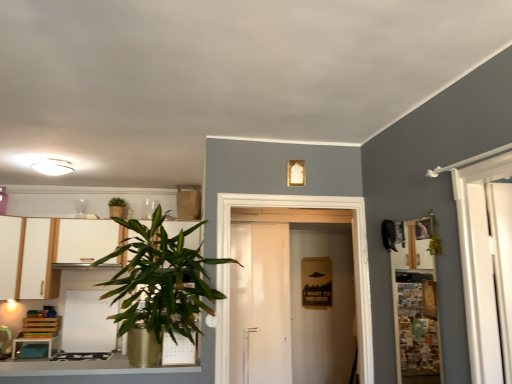
This screenshot has width=512, height=384. I want to click on white glossy cabinet at left, so click(49, 251).

Image resolution: width=512 pixels, height=384 pixels. Describe the element at coordinates (415, 304) in the screenshot. I see `wooden/matte shelf at right` at that location.

Consider the image. Measure the distance between wooden/matte shelf at right and camera.

The depth of wooden/matte shelf at right is 1.90 meters.

The width and height of the screenshot is (512, 384). I want to click on white matte cabinet at left, the second cabinetry in the left-to-right sequence, so click(27, 258).

This screenshot has width=512, height=384. What are the coordinates of `white matte cabinet at left, the 2th cabinetry in the right-to-left sequence` in the screenshot? It's located at (11, 255).

What do you see at coordinates (159, 287) in the screenshot?
I see `green leafy plant at left, which is counted as the second houseplant, starting from the back` at bounding box center [159, 287].

Locate an element on the screen. The height and width of the screenshot is (384, 512). white glossy cabinet at left is located at coordinates (49, 251).

Does white matte cabinet at left, the second cabinetry in the left-to-right sequence, appear on the left side of white glossy cabinet at left?

Indeed, white matte cabinet at left, the second cabinetry in the left-to-right sequence, is positioned on the left side of white glossy cabinet at left.

From a real-world perspective, does white matte cabinet at left, which appears as the first cabinetry when viewed from the right, sit lower than white glossy cabinet at left?

Yes, from a real-world perspective, white matte cabinet at left, which appears as the first cabinetry when viewed from the right, is beneath white glossy cabinet at left.

Would you consider white matte cabinet at left, which appears as the first cabinetry when viewed from the right, to be distant from white glossy cabinet at left?

They are positioned close to each other.

Would you say white glossy cabinet at left is part of white matte cabinet at left, which appears as the first cabinetry when viewed from the right,'s contents?

That's incorrect, white glossy cabinet at left is not inside white matte cabinet at left, which appears as the first cabinetry when viewed from the right.

Is green leafy plant at left, which is the first houseplant in right-to-left order, not inside green leafy plant at upper left, the first houseplant from the back?

green leafy plant at left, which is the first houseplant in right-to-left order, is positioned outside green leafy plant at upper left, the first houseplant from the back.

Is green leafy plant at left, the 1th houseplant viewed from the front, facing away from green leafy plant at upper left, the first houseplant from the back?

Absolutely, green leafy plant at left, the 1th houseplant viewed from the front, is directed away from green leafy plant at upper left, the first houseplant from the back.

Who is more distant, green leafy plant at left, which is the first houseplant in right-to-left order, or green leafy plant at upper left, the 2th houseplant viewed from the right?

green leafy plant at upper left, the 2th houseplant viewed from the right, is further away from the camera.

Can you tell me how much green leafy plant at left, the 1th houseplant viewed from the front, and green leafy plant at upper left, arranged as the 2th houseplant when viewed from the front, differ in facing direction?

The angle between the facing direction of green leafy plant at left, the 1th houseplant viewed from the front, and the facing direction of green leafy plant at upper left, arranged as the 2th houseplant when viewed from the front, is 3.14 degrees.

From the image's perspective, would you say white glossy cabinet at left is shown under white glossy stove at lower left?

Incorrect, from the image's perspective, white glossy cabinet at left is higher than white glossy stove at lower left.

Consider the image. Considering the relative positions of white glossy cabinet at left and white glossy stove at lower left in the image provided, is white glossy cabinet at left to the left of white glossy stove at lower left from the viewer's perspective?

In fact, white glossy cabinet at left is to the right of white glossy stove at lower left.

From a real-world perspective, is white glossy cabinet at left physically below white glossy stove at lower left?

No, from a real-world perspective, white glossy cabinet at left is not below white glossy stove at lower left.

From the image's perspective, relative to white matte door at center, is white glossy stove at lower left above or below?

Based on their image positions, white glossy stove at lower left is located beneath white matte door at center.

Is point (114, 326) farther from camera compared to point (362, 286)?

That is True.

Which object is thinner, white glossy stove at lower left or white matte door at center?

Thinner between the two is white glossy stove at lower left.

Considering the sizes of objects white glossy stove at lower left and white matte door at center in the image provided, who is taller, white glossy stove at lower left or white matte door at center?

white matte door at center is taller.

Is white matte cabinet at left, which appears as the first cabinetry when viewed from the right, bigger than green leafy plant at upper left, arranged as the 2th houseplant when viewed from the front?

Yes.

Is green leafy plant at upper left, arranged as the 2th houseplant when viewed from the front, at the back of white matte cabinet at left, which appears as the first cabinetry when viewed from the right?

No.

Find the location of `the 2nd cabinetry positioned below the green leafy plant at upper left, arranged as the 2th houseplant when viewed from the front (from a real-world perspective)`. the 2nd cabinetry positioned below the green leafy plant at upper left, arranged as the 2th houseplant when viewed from the front (from a real-world perspective) is located at coordinates (27, 258).

Which is correct: white matte cabinet at left, which appears as the first cabinetry when viewed from the right, is inside green leafy plant at upper left, the 2th houseplant viewed from the right, or outside of it?

white matte cabinet at left, which appears as the first cabinetry when viewed from the right, is outside green leafy plant at upper left, the 2th houseplant viewed from the right.

Where is `houseplant in front of the white glossy cabinet at left`? This screenshot has width=512, height=384. houseplant in front of the white glossy cabinet at left is located at coordinates (159, 287).

Is green leafy plant at left, the 1th houseplant viewed from the front, situated inside white glossy cabinet at left or outside?

green leafy plant at left, the 1th houseplant viewed from the front, is spatially situated outside white glossy cabinet at left.

Are green leafy plant at left, which is counted as the second houseplant, starting from the back, and white glossy cabinet at left making contact?

No, green leafy plant at left, which is counted as the second houseplant, starting from the back, is not touching white glossy cabinet at left.

Does point (116, 249) appear closer or farther from the camera than point (76, 247)?

Point (116, 249) is closer to the camera than point (76, 247).

From the image's perspective, is white matte cabinet at left, the second cabinetry in the left-to-right sequence, located beneath white matte cabinet at left, which appears as the first cabinetry when viewed from the left?

Yes, from the image's perspective, white matte cabinet at left, the second cabinetry in the left-to-right sequence, is beneath white matte cabinet at left, which appears as the first cabinetry when viewed from the left.

From a real-world perspective, is white matte cabinet at left, the second cabinetry in the left-to-right sequence, beneath white matte cabinet at left, the 2th cabinetry in the right-to-left sequence?

Indeed, from a real-world perspective, white matte cabinet at left, the second cabinetry in the left-to-right sequence, is positioned beneath white matte cabinet at left, the 2th cabinetry in the right-to-left sequence.

Is white matte cabinet at left, the second cabinetry in the left-to-right sequence, facing away from white matte cabinet at left, the 2th cabinetry in the right-to-left sequence?

No, white matte cabinet at left, the 2th cabinetry in the right-to-left sequence, is not at the back of white matte cabinet at left, the second cabinetry in the left-to-right sequence.

Where is `dresser above the white matte cabinet at left, which appears as the first cabinetry when viewed from the right (from the image's perspective)`? Image resolution: width=512 pixels, height=384 pixels. dresser above the white matte cabinet at left, which appears as the first cabinetry when viewed from the right (from the image's perspective) is located at coordinates (49, 251).

Identify the location of houseplant to the right of green leafy plant at upper left, the first houseplant from the back. (159, 287).

Looking at the image, which one is located closer to white matte door at center, white matte cabinet at left, which appears as the first cabinetry when viewed from the right, or white glossy stove at lower left?

white glossy stove at lower left is closer to white matte door at center.

Considering their positions, is green leafy plant at left, which is the first houseplant in right-to-left order, positioned closer to white matte door at center than white glossy stove at lower left?

green leafy plant at left, which is the first houseplant in right-to-left order, lies closer to white matte door at center than the other object.

Considering their positions, is white matte door at center positioned closer to white glossy stove at lower left than white matte cabinet at left, the second cabinetry in the left-to-right sequence?

white matte cabinet at left, the second cabinetry in the left-to-right sequence, is closer to white glossy stove at lower left.

Which object lies nearer to the anchor point white glossy stove at lower left, green leafy plant at left, which is counted as the second houseplant, starting from the back, or green leafy plant at upper left, the first houseplant from the back?

green leafy plant at left, which is counted as the second houseplant, starting from the back, is closer to white glossy stove at lower left.

Considering their positions, is white matte cabinet at left, the second cabinetry in the left-to-right sequence, positioned further to wooden/matte shelf at right than white glossy stove at lower left?

white matte cabinet at left, the second cabinetry in the left-to-right sequence, is positioned further to the anchor wooden/matte shelf at right.

Looking at the image, which one is located closer to white matte cabinet at left, the second cabinetry in the left-to-right sequence, white matte door at center or white glossy stove at lower left?

Among the two, white glossy stove at lower left is located nearer to white matte cabinet at left, the second cabinetry in the left-to-right sequence.

Looking at the image, which one is located closer to green leafy plant at left, the 1th houseplant viewed from the front, green leafy plant at upper left, the 1th houseplant in the left-to-right sequence, or white glossy stove at lower left?

green leafy plant at upper left, the 1th houseplant in the left-to-right sequence, is positioned closer to the anchor green leafy plant at left, the 1th houseplant viewed from the front.

Estimate the real-world distances between objects in this image. Which object is closer to wooden/matte shelf at right, green leafy plant at left, the 2th houseplant positioned from the left, or white glossy stove at lower left?

The object closer to wooden/matte shelf at right is green leafy plant at left, the 2th houseplant positioned from the left.

I want to click on dresser positioned between green leafy plant at left, the 2th houseplant positioned from the left, and white glossy stove at lower left from near to far, so click(49, 251).

Where is `door between green leafy plant at left, the 1th houseplant viewed from the front, and green leafy plant at upper left, the first houseplant from the back, from front to back`? door between green leafy plant at left, the 1th houseplant viewed from the front, and green leafy plant at upper left, the first houseplant from the back, from front to back is located at coordinates (353, 252).

You are a GUI agent. You are given a task and a screenshot of the screen. Output one action in this format:
    pyautogui.click(x=<x>, y=<y>)
    Task: Click on the door located between wooden/matte shelf at right and green leafy plant at upper left, the first houseplant from the back, in the depth direction
    Image resolution: width=512 pixels, height=384 pixels.
    Given the screenshot: What is the action you would take?
    (353, 252)

Locate an element on the screen. The height and width of the screenshot is (384, 512). appliance between white matte cabinet at left, the 2th cabinetry in the right-to-left sequence, and wooden/matte shelf at right, in the horizontal direction is located at coordinates (88, 323).